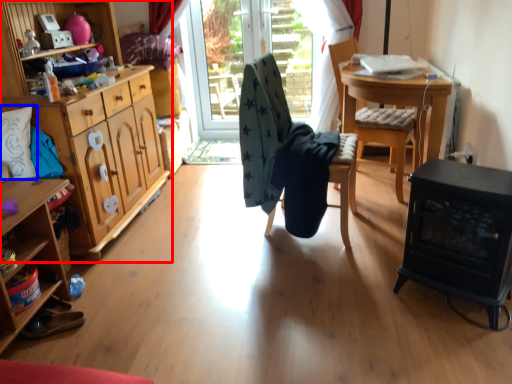
Question: Which object appears farthest to the camera in this image, cabinetry (highlighted by a red box) or pillow (highlighted by a blue box)?

Choices:
 (A) cabinetry
 (B) pillow

Answer: (B)